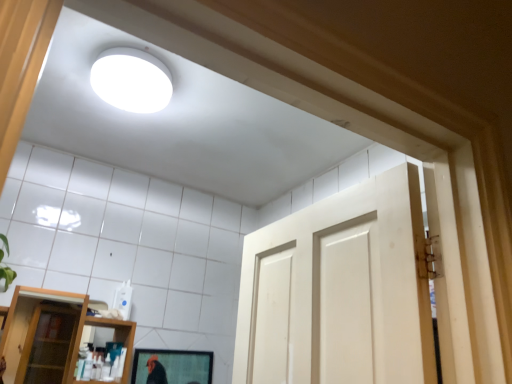
Question: From the image's perspective, relative to white matte light fixture at upper center, is transparent glass shelf at lower left above or below?

Choices:
 (A) above
 (B) below

Answer: (B)

Question: In the image, is transparent glass shelf at lower left on the left side or the right side of white matte light fixture at upper center?

Choices:
 (A) left
 (B) right

Answer: (A)

Question: Which is farther from the white matte light fixture at upper center?

Choices:
 (A) transparent glass shelf at lower left
 (B) matte black mirror at lower center

Answer: (A)

Question: Estimate the real-world distances between objects in this image. Which object is closer to the transparent glass shelf at lower left?

Choices:
 (A) matte black mirror at lower center
 (B) white matte light fixture at upper center

Answer: (A)